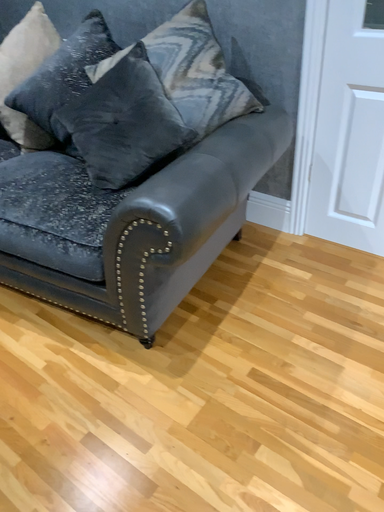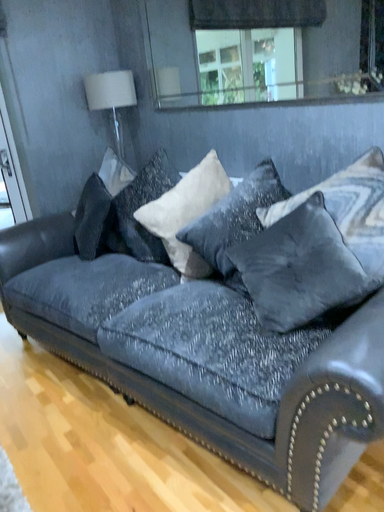
Question: Which way did the camera rotate in the video?

Choices:
 (A) rotated upward
 (B) rotated downward

Answer: (A)